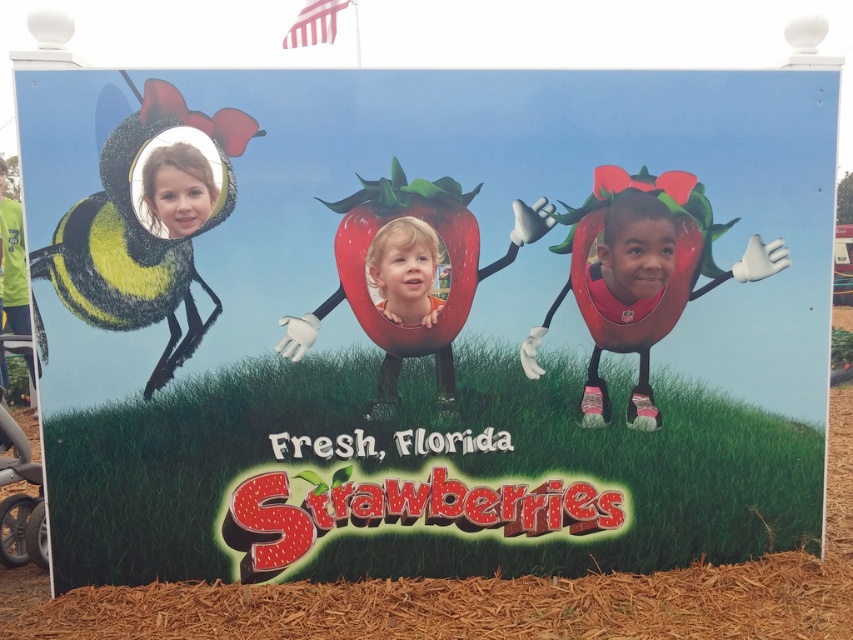
Based on the scene description, can you determine if the smooth orange shirt at center is wider than the smooth skin face at upper left?

The smooth orange shirt at center might be wider than smooth skin face at upper left according to the description.

You are standing in front of the poster and notice two points marked on it. The first point is at coordinates point (439, 300) and the second point is at point (201, 180). Which point is closer to you?

Point (201, 180) is closer to you because it is in front of point (439, 300).